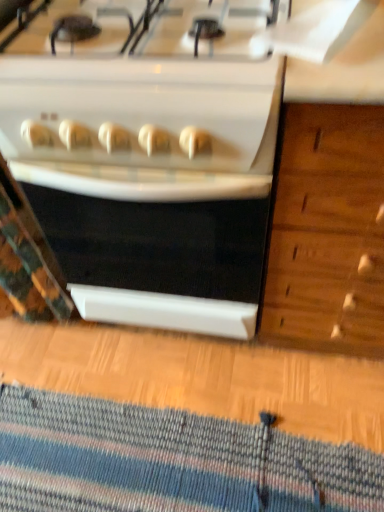
Question: Relative to white glossy stove at center, is striped wool doormat at lower center in front or behind?

Choices:
 (A) front
 (B) behind

Answer: (B)

Question: Does point (132, 435) appear closer or farther from the camera than point (178, 288)?

Choices:
 (A) closer
 (B) farther

Answer: (B)

Question: From a real-world perspective, is striped wool doormat at lower center physically located above or below white glossy stove at center?

Choices:
 (A) above
 (B) below

Answer: (B)

Question: Based on their sizes in the image, would you say white glossy stove at center is bigger or smaller than striped wool doormat at lower center?

Choices:
 (A) small
 (B) big

Answer: (B)

Question: In terms of height, does white glossy stove at center look taller or shorter compared to striped wool doormat at lower center?

Choices:
 (A) tall
 (B) short

Answer: (A)

Question: From the image's perspective, is white glossy stove at center positioned above or below striped wool doormat at lower center?

Choices:
 (A) below
 (B) above

Answer: (B)

Question: Considering the positions of white glossy stove at center and striped wool doormat at lower center in the image, is white glossy stove at center wider or thinner than striped wool doormat at lower center?

Choices:
 (A) thin
 (B) wide

Answer: (B)